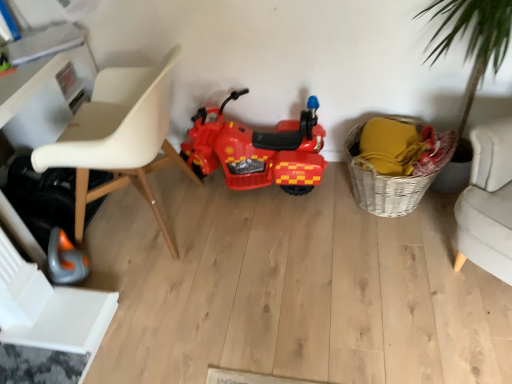
Locate an element on the screen. The image size is (512, 384). free space that is to the left of woven basket at lower right is located at coordinates (313, 222).